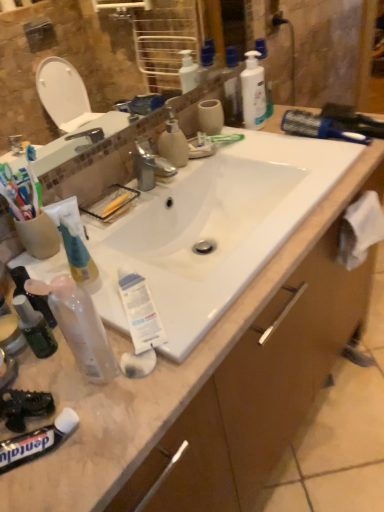
Identify the location of spots to the right of black matte toothpaste at lower left, arranged as the 1th toothpaste when viewed from the front. This screenshot has width=384, height=512. (114, 425).